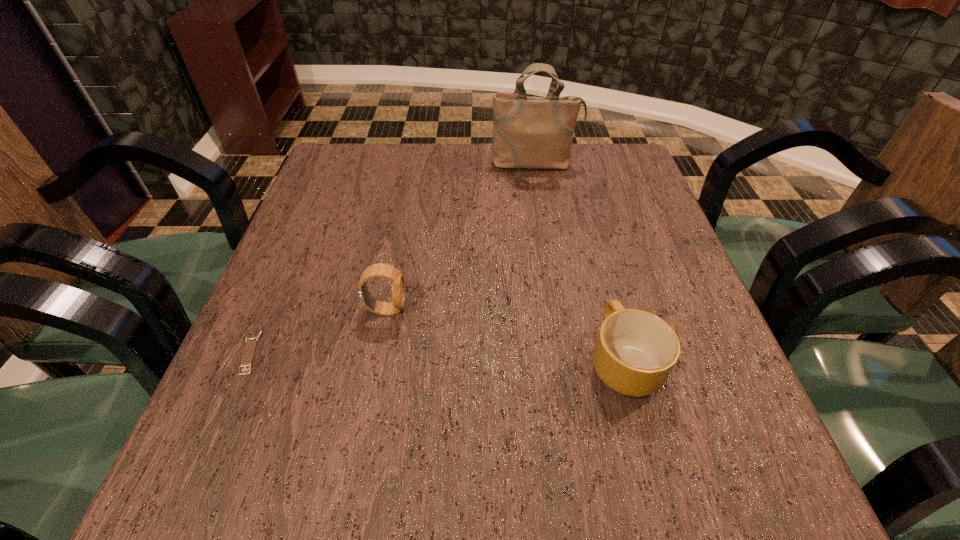
Locate an element on the screen. The image size is (960, 540). free spot between the second shortest object and the second object from left to right is located at coordinates (505, 336).

Locate an element on the screen. The height and width of the screenshot is (540, 960). empty location between the mug and the second farthest object is located at coordinates (505, 336).

Locate an element on the screen. vacant space that's between the taller watch and the tallest object is located at coordinates (461, 237).

What are the coordinates of `empty space between the left watch and the third tallest object` in the screenshot? It's located at (436, 355).

Identify which object is the third closest to the right watch. Please provide its 2D coordinates. Your answer should be formatted as a tuple, i.e. [(x, y)], where the tuple contains the x and y coordinates of a point satisfying the conditions above.

[(529, 132)]

Select which object appears as the closest to the shoulder bag. Please provide its 2D coordinates. Your answer should be formatted as a tuple, i.e. [(x, y)], where the tuple contains the x and y coordinates of a point satisfying the conditions above.

[(387, 271)]

Locate an element on the screen. vacant area that satisfies the following two spatial constraints: 1. on the front-facing side of the farthest object; 2. on the face of the third shortest object is located at coordinates (559, 310).

Find the location of `free space that satisfies the following two spatial constraints: 1. on the face of the second farthest object; 2. on the side with the handle of the mug`. free space that satisfies the following two spatial constraints: 1. on the face of the second farthest object; 2. on the side with the handle of the mug is located at coordinates (376, 361).

What are the coordinates of `free space that satisfies the following two spatial constraints: 1. on the front-facing side of the tallest object; 2. on the face of the third nearest object` in the screenshot? It's located at (559, 310).

At what (x,y) coordinates should I click in order to perform the action: click on vacant space that satisfies the following two spatial constraints: 1. on the face of the second object from left to right; 2. on the side with the handle of the third tallest object. Please return your answer as a coordinate pair (x, y). The image size is (960, 540). Looking at the image, I should click on (376, 361).